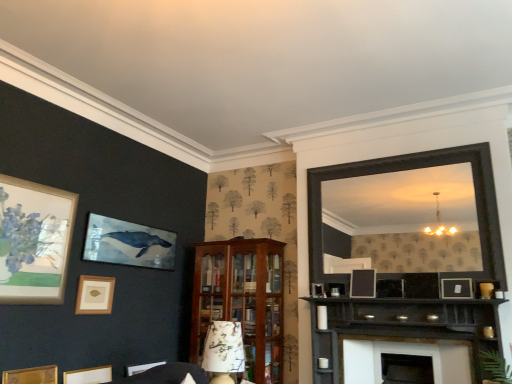
Question: From the image's perspective, is wooden picture frame at lower left, the fifth picture frame when ordered from right to left, on top of wooden cabinet at center?

Choices:
 (A) no
 (B) yes

Answer: (A)

Question: Is wooden cabinet at center surrounded by wooden picture frame at lower left, the first picture frame from the left?

Choices:
 (A) no
 (B) yes

Answer: (A)

Question: Can you confirm if wooden picture frame at lower left, the fifth picture frame when ordered from right to left, is thinner than wooden cabinet at center?

Choices:
 (A) no
 (B) yes

Answer: (B)

Question: Are wooden picture frame at lower left, the fifth picture frame when ordered from right to left, and wooden cabinet at center making contact?

Choices:
 (A) yes
 (B) no

Answer: (B)

Question: Can you confirm if wooden picture frame at lower left, the fifth picture frame when ordered from right to left, is wider than wooden cabinet at center?

Choices:
 (A) yes
 (B) no

Answer: (B)

Question: Does wooden picture frame at lower left, the fifth picture frame when ordered from right to left, appear on the left side of wooden cabinet at center?

Choices:
 (A) no
 (B) yes

Answer: (B)

Question: From a real-world perspective, is matte gold picture frame at lower left, positioned as the 3th picture frame in left-to-right order, on white glossy fireplace at lower center?

Choices:
 (A) no
 (B) yes

Answer: (A)

Question: Is the depth of matte gold picture frame at lower left, positioned as the 3th picture frame in left-to-right order, greater than that of white glossy fireplace at lower center?

Choices:
 (A) yes
 (B) no

Answer: (A)

Question: Does matte gold picture frame at lower left, positioned as the 3th picture frame in left-to-right order, have a smaller size compared to white glossy fireplace at lower center?

Choices:
 (A) yes
 (B) no

Answer: (A)

Question: Considering the relative positions of matte gold picture frame at lower left, the 3th picture frame from the right, and white glossy fireplace at lower center in the image provided, is matte gold picture frame at lower left, the 3th picture frame from the right, to the right of white glossy fireplace at lower center from the viewer's perspective?

Choices:
 (A) yes
 (B) no

Answer: (B)

Question: Is matte gold picture frame at lower left, the 3th picture frame from the right, thinner than white glossy fireplace at lower center?

Choices:
 (A) no
 (B) yes

Answer: (B)

Question: Can you confirm if matte gold picture frame at lower left, positioned as the 3th picture frame in left-to-right order, is taller than white glossy fireplace at lower center?

Choices:
 (A) yes
 (B) no

Answer: (B)

Question: Is matte black picture frame at center, which is counted as the 4th picture frame, starting from the left, at the left side of matte gold picture frame at lower left, the 3th picture frame from the right?

Choices:
 (A) yes
 (B) no

Answer: (B)